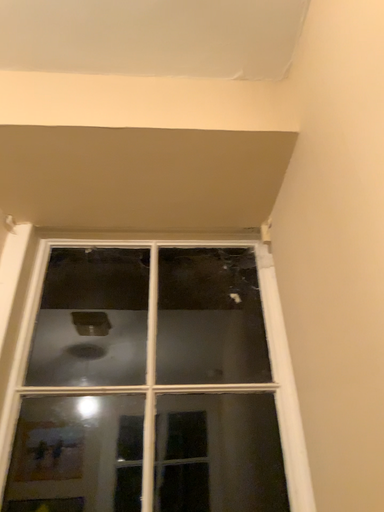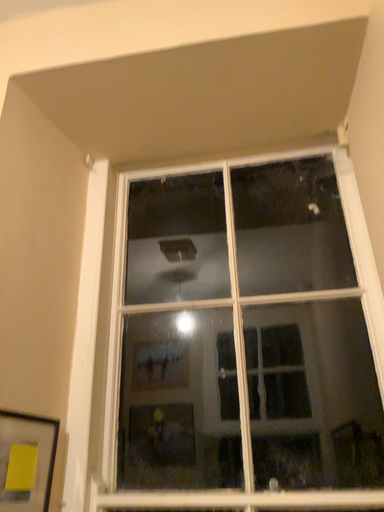
Question: How did the camera likely rotate when shooting the video?

Choices:
 (A) rotated left
 (B) rotated right

Answer: (A)